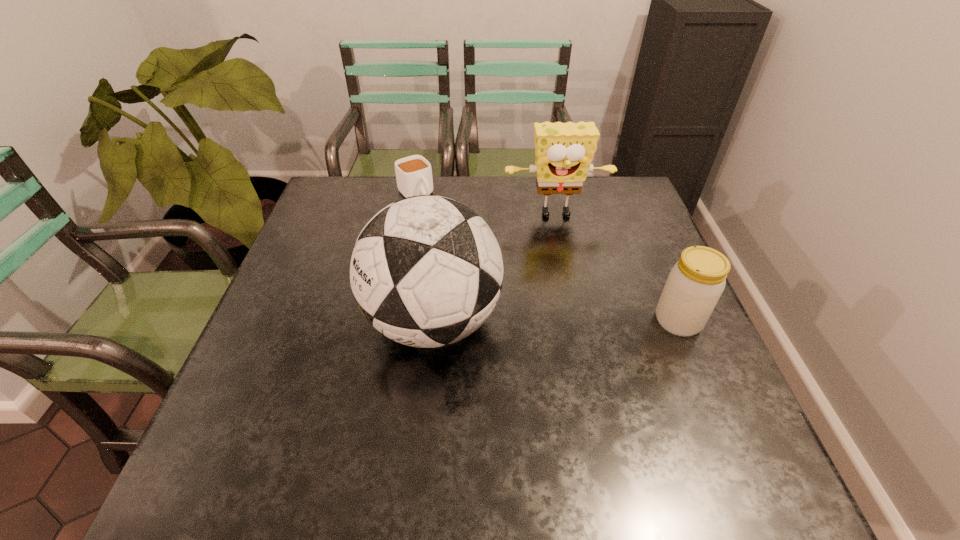
At what (x,y) coordinates should I click in order to perform the action: click on free spot on the desktop that is between the soccer ball and the rightmost object and is positioned on the front-facing side of the third shortest object. Please return your answer as a coordinate pair (x, y). The width and height of the screenshot is (960, 540). Looking at the image, I should click on (581, 321).

Locate an element on the screen. This screenshot has width=960, height=540. vacant space on the desktop that is between the soccer ball and the jar and is positioned on the side with the handle of the shortest object is located at coordinates (534, 321).